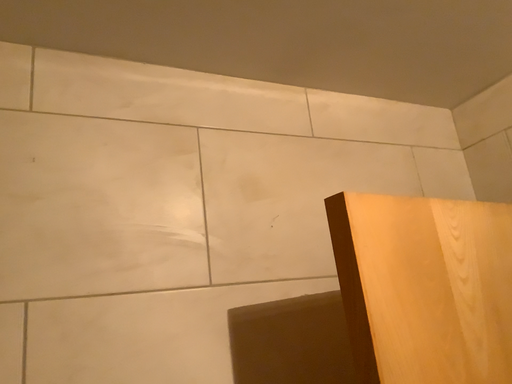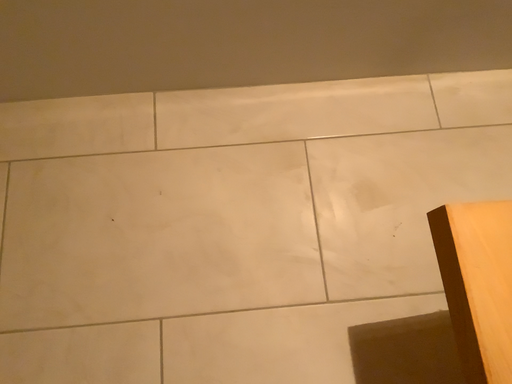
Question: Which way did the camera rotate in the video?

Choices:
 (A) rotated right
 (B) rotated left

Answer: (B)